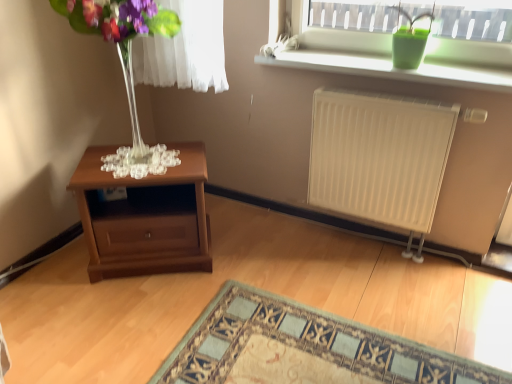
Identify the location of free space that is in between white matte radiator at right and carpet with intricate pattern at lower center. The width and height of the screenshot is (512, 384). (376, 290).